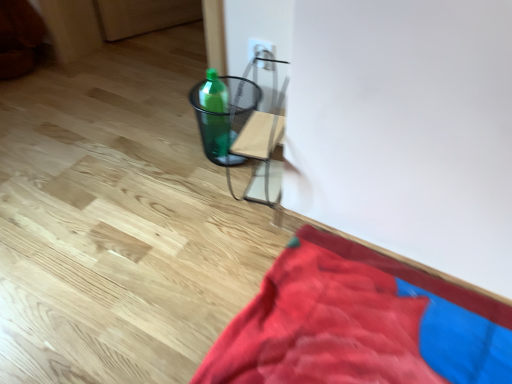
Where is `vacant region above velvet red blanket at lower right (from a real-world perspective)`? Image resolution: width=512 pixels, height=384 pixels. vacant region above velvet red blanket at lower right (from a real-world perspective) is located at coordinates (366, 321).